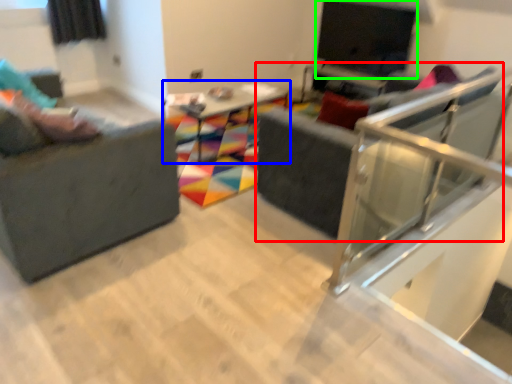
Question: Estimate the real-world distances between objects in this image. Which object is closer to swivel chair (highlighted by a red box), table (highlighted by a blue box) or window screen (highlighted by a green box)?

Choices:
 (A) table
 (B) window screen

Answer: (A)